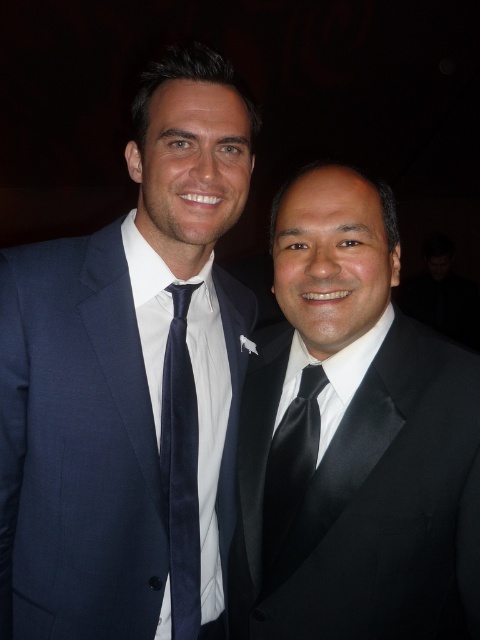
In the scene shown: You are a photographer adjusting the camera focus. You need to focus on the navy blue suit at left and the black satin tie at center. Which one should you focus on first if you want to ensure both are in focus, considering their positions?

The navy blue suit at left is closer to the viewer than the black satin tie at center, so you should focus on the navy blue suit at left first to ensure both are in focus.